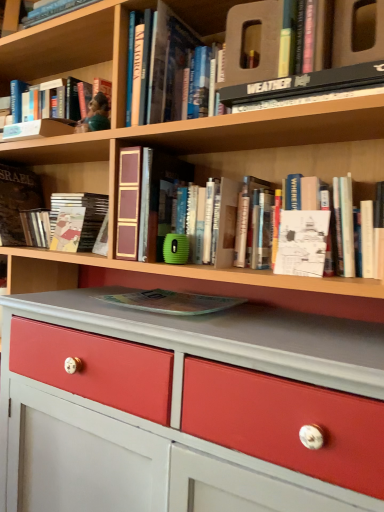
Question: From a real-world perspective, is transparent plastic magazine at center, which is the fifth book from left to right, positioned over white paper at center based on gravity?

Choices:
 (A) yes
 (B) no

Answer: (B)

Question: Is transparent plastic magazine at center, the fourth book positioned from the right, to the left of white paper at center from the viewer's perspective?

Choices:
 (A) yes
 (B) no

Answer: (A)

Question: Does transparent plastic magazine at center, the fourth book positioned from the right, have a greater width compared to white paper at center?

Choices:
 (A) yes
 (B) no

Answer: (A)

Question: From the image's perspective, is transparent plastic magazine at center, which is the fifth book from left to right, located above white paper at center?

Choices:
 (A) no
 (B) yes

Answer: (A)

Question: Does transparent plastic magazine at center, the fourth book positioned from the right, turn towards white paper at center?

Choices:
 (A) yes
 (B) no

Answer: (B)

Question: Does transparent plastic magazine at center, the fourth book positioned from the right, have a lesser width compared to white paper at center?

Choices:
 (A) yes
 (B) no

Answer: (B)

Question: Can you confirm if white paper book at upper right, placed as the 1th book when sorted from right to left, is smaller than black hardcover book at upper center, acting as the seventh book starting from the left?

Choices:
 (A) no
 (B) yes

Answer: (A)

Question: Is white paper book at upper right, placed as the 1th book when sorted from right to left, taller than black hardcover book at upper center, acting as the seventh book starting from the left?

Choices:
 (A) yes
 (B) no

Answer: (A)

Question: Can you confirm if white paper book at upper right, which is the eighth book from left to right, is thinner than black hardcover book at upper center, the 2th book when ordered from right to left?

Choices:
 (A) no
 (B) yes

Answer: (B)

Question: Is the position of white paper book at upper right, which is the eighth book from left to right, more distant than that of black hardcover book at upper center, the 2th book when ordered from right to left?

Choices:
 (A) no
 (B) yes

Answer: (B)

Question: Is white paper book at upper right, which is the eighth book from left to right, to the left of black hardcover book at upper center, acting as the seventh book starting from the left, from the viewer's perspective?

Choices:
 (A) no
 (B) yes

Answer: (A)

Question: Is white paper book at upper right, which is the eighth book from left to right, outside black hardcover book at upper center, acting as the seventh book starting from the left?

Choices:
 (A) no
 (B) yes

Answer: (B)

Question: Is black hardcover book at upper center, acting as the seventh book starting from the left, directly adjacent to white paper at center?

Choices:
 (A) yes
 (B) no

Answer: (B)